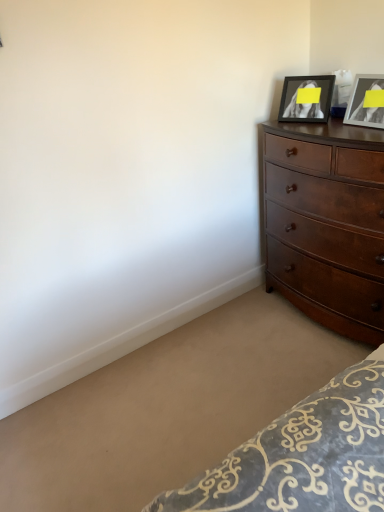
Question: From the image's perspective, is matte black picture frame at upper right, marked as the 1th picture frame in a left-to-right arrangement, above or below matte black picture frame at upper right, marked as the first picture frame in a right-to-left arrangement?

Choices:
 (A) below
 (B) above

Answer: (B)

Question: Is matte black picture frame at upper right, marked as the 1th picture frame in a left-to-right arrangement, in front of or behind matte black picture frame at upper right, the second picture frame positioned from the left, in the image?

Choices:
 (A) front
 (B) behind

Answer: (B)

Question: Which of these objects is positioned closest to the matte black picture frame at upper right, marked as the first picture frame in a right-to-left arrangement?

Choices:
 (A) matte black picture frame at upper right, which is the 2th picture frame in right-to-left order
 (B) dark brown wood dresser at right

Answer: (A)

Question: Which object is the farthest from the dark brown wood dresser at right?

Choices:
 (A) matte black picture frame at upper right, marked as the 1th picture frame in a left-to-right arrangement
 (B) matte black picture frame at upper right, marked as the first picture frame in a right-to-left arrangement

Answer: (A)